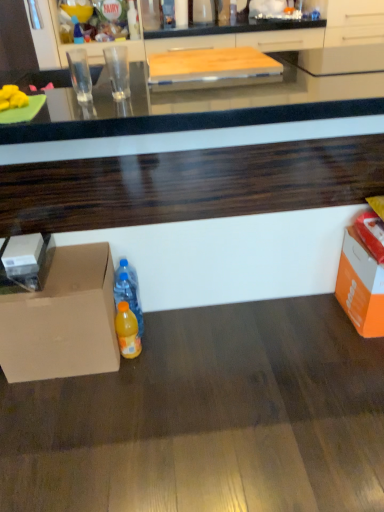
This screenshot has width=384, height=512. In order to click on spots to the right of white cardboard box at left in this screenshot , I will do `click(78, 279)`.